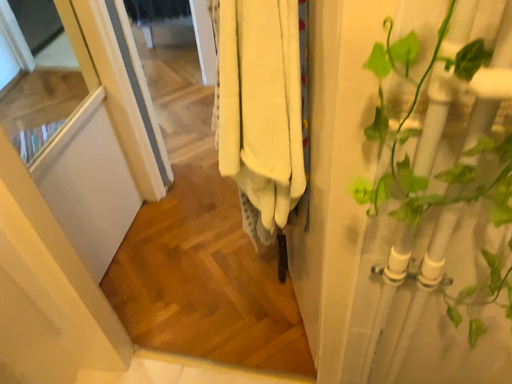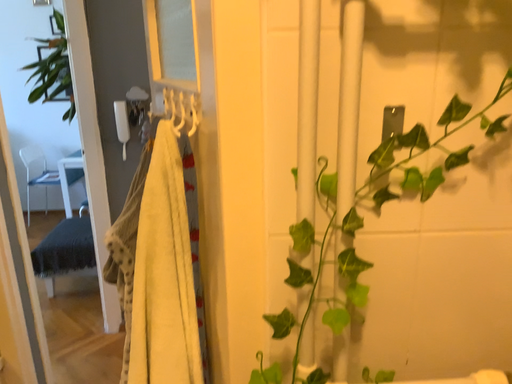
Question: Which way did the camera rotate in the video?

Choices:
 (A) rotated right
 (B) rotated left

Answer: (A)